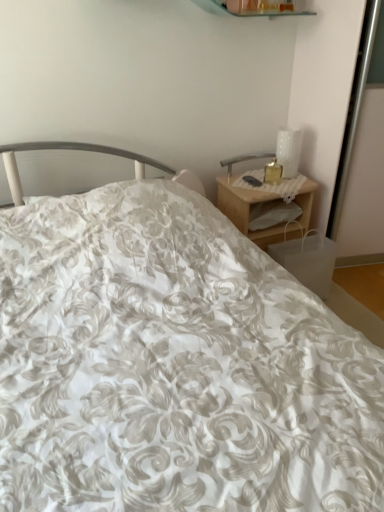
The width and height of the screenshot is (384, 512). In order to click on vacant space to the left of translucent glass candle at upper right in this screenshot , I will do `click(250, 182)`.